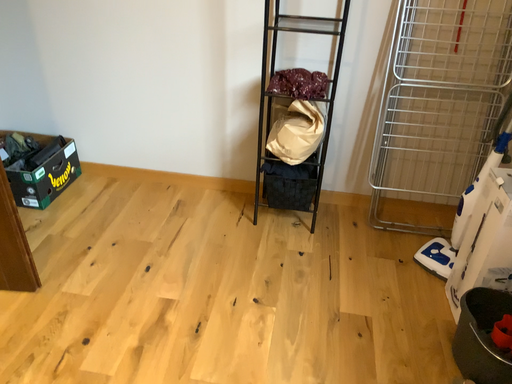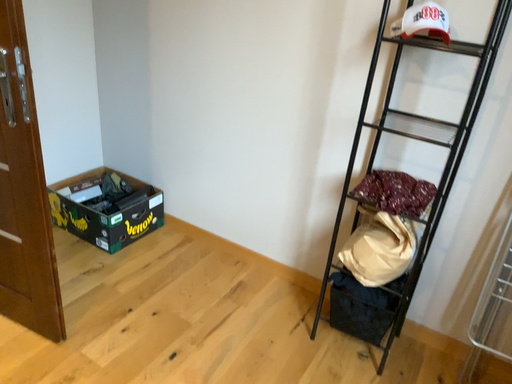
Question: Which way did the camera rotate in the video?

Choices:
 (A) rotated upward
 (B) rotated downward

Answer: (A)